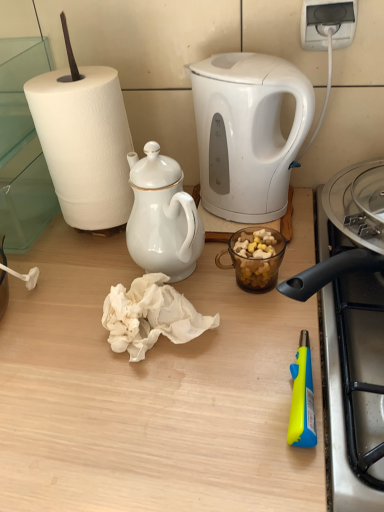
Question: From the image's perspective, is wooden table at center above or below translucent glass mug at center?

Choices:
 (A) below
 (B) above

Answer: (A)

Question: From their relative heights in the image, would you say wooden table at center is taller or shorter than translucent glass mug at center?

Choices:
 (A) short
 (B) tall

Answer: (B)

Question: Considering the real-world distances, which object is farthest from the wooden table at center?

Choices:
 (A) white plastic power outlet at upper right
 (B) white crumpled paper towel at center
 (C) translucent glass mug at center
 (D) white glossy electric kettle at upper center
 (E) white porcelain teapot at upper center

Answer: (A)

Question: Which object is positioned farthest from the wooden table at center?

Choices:
 (A) white glossy electric kettle at upper center
 (B) white plastic power outlet at upper right
 (C) white crumpled paper towel at center
 (D) white porcelain teapot at upper center
 (E) translucent glass mug at center

Answer: (B)